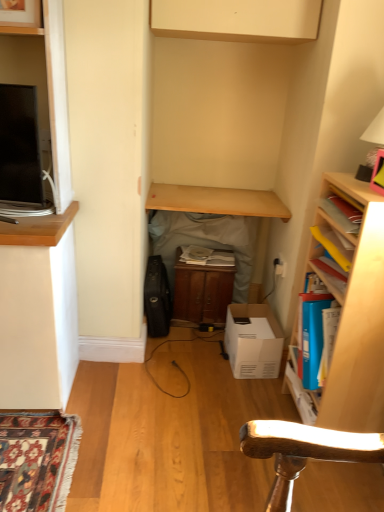
Question: Is light wood table at center, which ranks as the second table in bottom-to-top order, wider than wooden cabinet at center, marked as the 2th table in a top-to-bottom arrangement?

Choices:
 (A) yes
 (B) no

Answer: (A)

Question: Considering the relative sizes of light wood table at center, the first table viewed from the top, and wooden cabinet at center, marked as the 2th table in a top-to-bottom arrangement, in the image provided, is light wood table at center, the first table viewed from the top, shorter than wooden cabinet at center, marked as the 2th table in a top-to-bottom arrangement,?

Choices:
 (A) yes
 (B) no

Answer: (A)

Question: Is the depth of light wood table at center, which ranks as the second table in bottom-to-top order, less than that of wooden cabinet at center, placed as the 1th table when sorted from bottom to top?

Choices:
 (A) yes
 (B) no

Answer: (A)

Question: Is light wood table at center, which ranks as the second table in bottom-to-top order, completely or partially outside of wooden cabinet at center, placed as the 1th table when sorted from bottom to top?

Choices:
 (A) yes
 (B) no

Answer: (A)

Question: From a real-world perspective, is light wood table at center, the first table viewed from the top, located beneath wooden cabinet at center, placed as the 1th table when sorted from bottom to top?

Choices:
 (A) yes
 (B) no

Answer: (B)

Question: Considering their positions, is white matte lampshade at upper right located in front of or behind light wood table at center, which ranks as the second table in bottom-to-top order?

Choices:
 (A) behind
 (B) front

Answer: (B)

Question: Visually, is white matte lampshade at upper right positioned to the left or to the right of light wood table at center, which ranks as the second table in bottom-to-top order?

Choices:
 (A) left
 (B) right

Answer: (B)

Question: Considering the positions of point (379, 152) and point (195, 209), is point (379, 152) closer or farther from the camera than point (195, 209)?

Choices:
 (A) farther
 (B) closer

Answer: (B)

Question: Considering the positions of white matte lampshade at upper right and light wood table at center, the first table viewed from the top, in the image, is white matte lampshade at upper right taller or shorter than light wood table at center, the first table viewed from the top,?

Choices:
 (A) short
 (B) tall

Answer: (B)

Question: Is white cardboard box at center wider or thinner than wooden cabinet at center?

Choices:
 (A) wide
 (B) thin

Answer: (A)

Question: From a real-world perspective, is white cardboard box at center above or below wooden cabinet at center?

Choices:
 (A) above
 (B) below

Answer: (B)

Question: Is white cardboard box at center taller or shorter than wooden cabinet at center?

Choices:
 (A) tall
 (B) short

Answer: (B)

Question: In the image, is white cardboard box at center positioned in front of or behind wooden cabinet at center?

Choices:
 (A) behind
 (B) front

Answer: (B)

Question: Would you say white plastic electric outlet at center-right is to the left or to the right of wooden cabinet at center, marked as the 2th table in a top-to-bottom arrangement, in the picture?

Choices:
 (A) left
 (B) right

Answer: (B)

Question: Considering the positions of white plastic electric outlet at center-right and wooden cabinet at center, marked as the 2th table in a top-to-bottom arrangement, in the image, is white plastic electric outlet at center-right bigger or smaller than wooden cabinet at center, marked as the 2th table in a top-to-bottom arrangement,?

Choices:
 (A) big
 (B) small

Answer: (B)